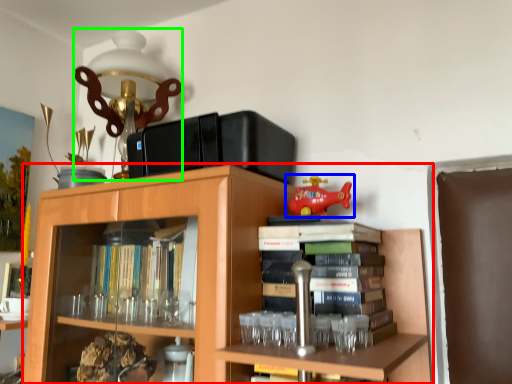
Question: Estimate the real-world distances between objects in this image. Which object is closer to bookcase (highlighted by a red box), toy (highlighted by a blue box) or table lamp (highlighted by a green box)?

Choices:
 (A) toy
 (B) table lamp

Answer: (A)